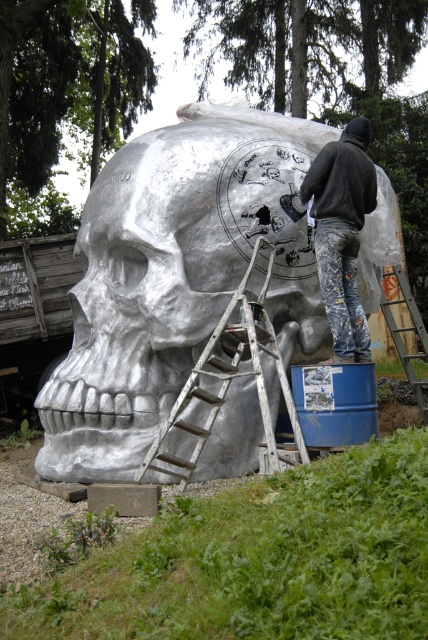
Question: Is brushed metal skull at center wider than brushed metal ladder at lower right?

Choices:
 (A) no
 (B) yes

Answer: (B)

Question: Which point is farther to the camera?

Choices:
 (A) brushed metal ladder at lower right
 (B) brushed wood ladder at center
 (C) brushed metal skull at center

Answer: (A)

Question: Can you confirm if dark gray hoodie at center is positioned to the right of brushed wood ladder at center?

Choices:
 (A) no
 (B) yes

Answer: (B)

Question: Can you confirm if brushed wood ladder at center is smaller than brushed metal ladder at lower right?

Choices:
 (A) no
 (B) yes

Answer: (A)

Question: Which of the following is the closest to the observer?

Choices:
 (A) (427, 381)
 (B) (278, 260)
 (C) (335, 168)

Answer: (C)

Question: Among these points, which one is farthest from the camera?

Choices:
 (A) (419, 408)
 (B) (219, 369)
 (C) (184, 168)
 (D) (344, 250)

Answer: (A)